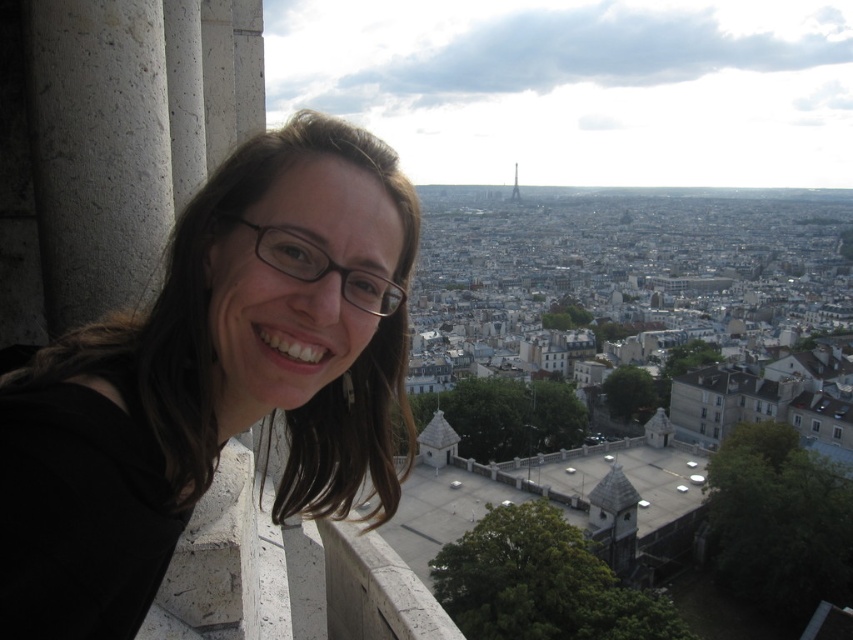
Question: Is the position of matte black hair at left more distant than that of metallic gold eiffel tower at center?

Choices:
 (A) no
 (B) yes

Answer: (A)

Question: Does matte black hair at left appear on the right side of metallic gold eiffel tower at center?

Choices:
 (A) yes
 (B) no

Answer: (B)

Question: Among these points, which one is nearest to the camera?

Choices:
 (A) (166, 282)
 (B) (514, 195)

Answer: (A)

Question: Which of the following is the farthest from the observer?

Choices:
 (A) (514, 189)
 (B) (294, 237)

Answer: (A)

Question: Which object is farther from the camera taking this photo?

Choices:
 (A) metallic gold eiffel tower at center
 (B) matte black hair at left

Answer: (A)

Question: Does matte black hair at left have a smaller size compared to metallic gold eiffel tower at center?

Choices:
 (A) yes
 (B) no

Answer: (B)